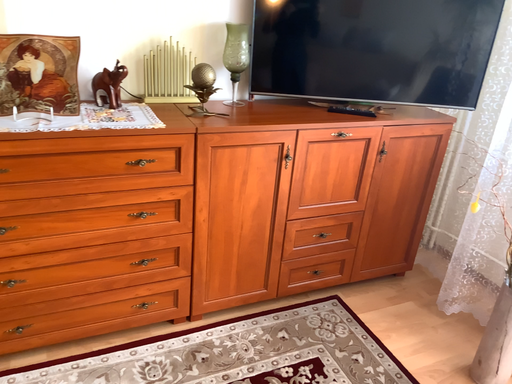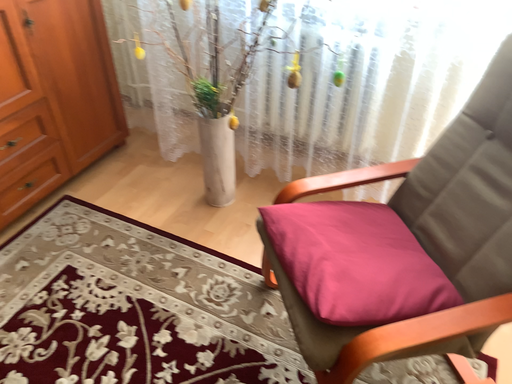
Question: How did the camera likely rotate when shooting the video?

Choices:
 (A) rotated upward
 (B) rotated downward

Answer: (B)